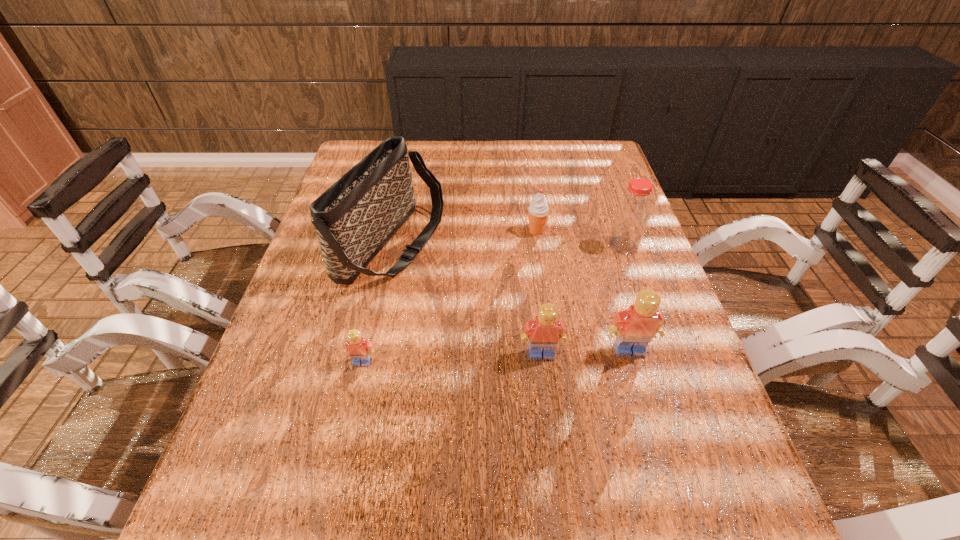
At what (x,y) coordinates should I click in order to perform the action: click on vacant space at the far right corner. Please return your answer as a coordinate pair (x, y). The image size is (960, 540). Looking at the image, I should click on (581, 157).

I want to click on free region at the near right corner of the desktop, so click(x=715, y=461).

Identify the location of free space between the icecream and the shortest object. pos(449,296).

At what (x,y) coordinates should I click in order to perform the action: click on free point between the shortest Lego and the second Lego from right to left. Please return your answer as a coordinate pair (x, y). Image resolution: width=960 pixels, height=540 pixels. Looking at the image, I should click on (452, 358).

Locate an element on the screen. The width and height of the screenshot is (960, 540). free spot between the second Lego from left to right and the rightmost Lego is located at coordinates (586, 352).

Where is `vacant point located between the handbag and the icecream`? The width and height of the screenshot is (960, 540). vacant point located between the handbag and the icecream is located at coordinates (464, 238).

Identify the location of free space that is in between the second shortest Lego and the icecream. This screenshot has width=960, height=540. (539, 292).

Identify the location of free space between the second tallest Lego and the bottle. (583, 300).

I want to click on vacant area that lies between the rightmost Lego and the second Lego from right to left, so click(x=586, y=352).

Locate an element on the screen. free space between the rightmost Lego and the handbag is located at coordinates (511, 298).